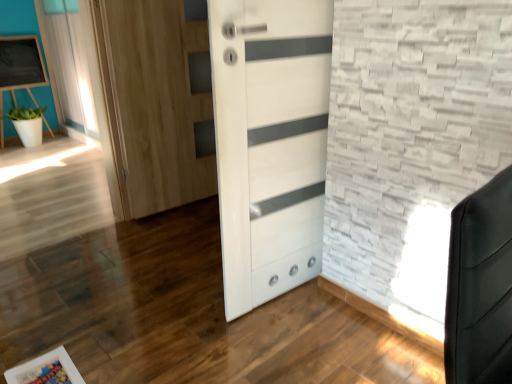
Question: Considering the relative sizes of matte black chalkboard at upper left and white sheer curtain at upper left in the image provided, is matte black chalkboard at upper left shorter than white sheer curtain at upper left?

Choices:
 (A) yes
 (B) no

Answer: (A)

Question: Is matte black chalkboard at upper left positioned behind white sheer curtain at upper left?

Choices:
 (A) yes
 (B) no

Answer: (A)

Question: Is matte black chalkboard at upper left turned away from white sheer curtain at upper left?

Choices:
 (A) yes
 (B) no

Answer: (B)

Question: From the image's perspective, is matte black chalkboard at upper left above white sheer curtain at upper left?

Choices:
 (A) yes
 (B) no

Answer: (B)

Question: From a real-world perspective, is matte black chalkboard at upper left below white sheer curtain at upper left?

Choices:
 (A) no
 (B) yes

Answer: (B)

Question: Considering the relative sizes of matte black chalkboard at upper left and white sheer curtain at upper left in the image provided, is matte black chalkboard at upper left thinner than white sheer curtain at upper left?

Choices:
 (A) yes
 (B) no

Answer: (B)

Question: Does white matte pot at left have a greater height compared to matte black chalkboard at upper left?

Choices:
 (A) yes
 (B) no

Answer: (B)

Question: Is white matte pot at left surrounding matte black chalkboard at upper left?

Choices:
 (A) yes
 (B) no

Answer: (B)

Question: Can you see white matte pot at left touching matte black chalkboard at upper left?

Choices:
 (A) no
 (B) yes

Answer: (A)

Question: Is white matte pot at left wider than matte black chalkboard at upper left?

Choices:
 (A) no
 (B) yes

Answer: (B)

Question: Is white matte pot at left facing away from matte black chalkboard at upper left?

Choices:
 (A) yes
 (B) no

Answer: (A)

Question: From a real-world perspective, is white matte pot at left on matte black chalkboard at upper left?

Choices:
 (A) yes
 (B) no

Answer: (B)

Question: Is white sheer curtain at upper left at the left side of wooden picture frame at lower left?

Choices:
 (A) yes
 (B) no

Answer: (A)